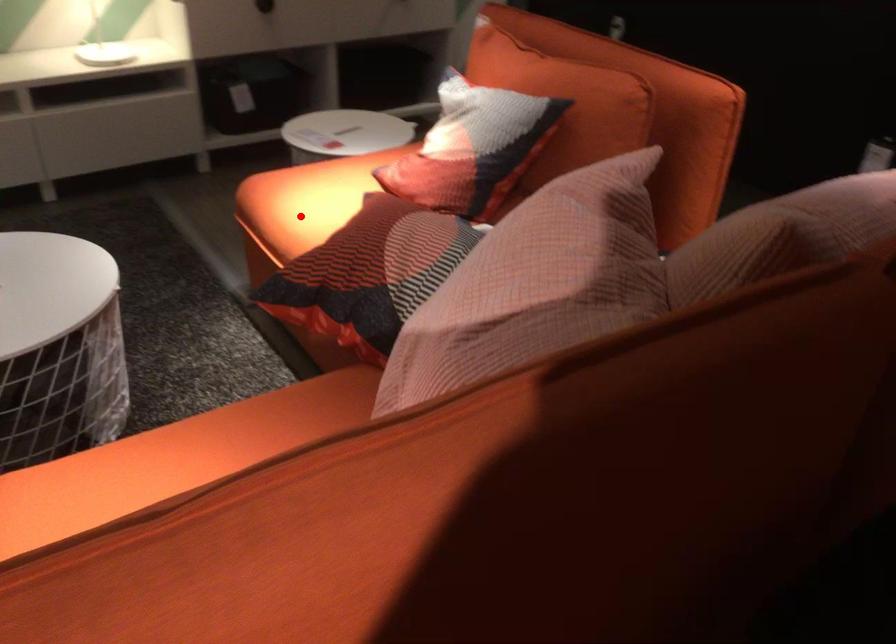
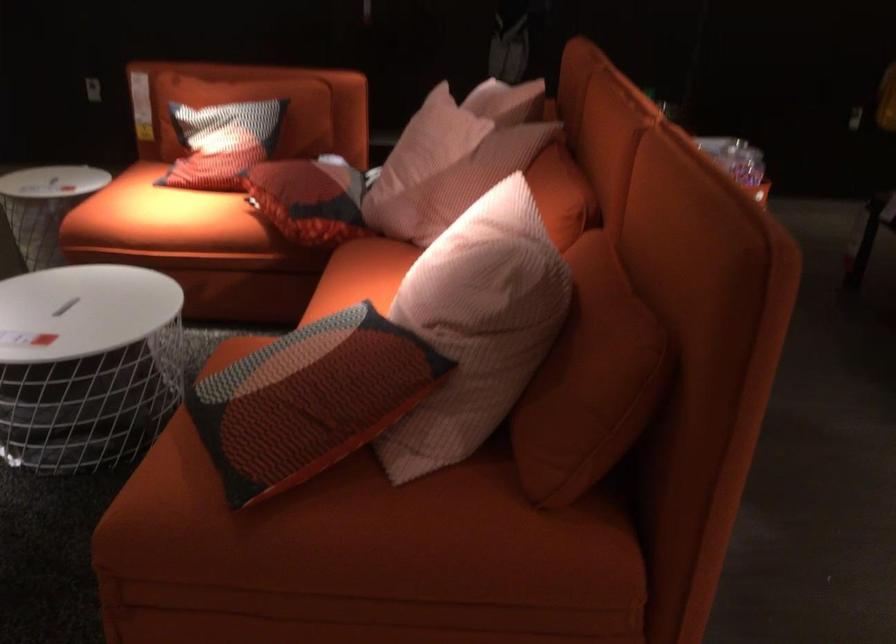
In the second image, find the point that corresponds to the highlighted location in the first image.

(160, 216)